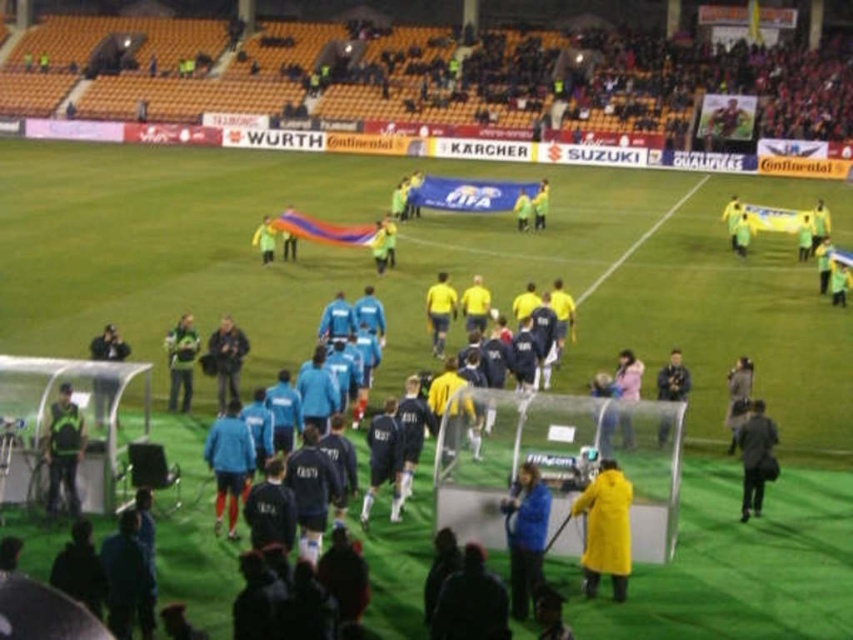
Question: Among these points, which one is farthest from the camera?

Choices:
 (A) (105, 340)
 (B) (223, 502)
 (C) (756, 474)

Answer: (A)

Question: Considering the real-world distances, which object is farthest from the yellow matte shirt at center?

Choices:
 (A) blue fabric jacket at center
 (B) black matte jacket at lower right
 (C) yellow matte raincoat at lower right
 (D) dark blue jacket at center

Answer: (C)

Question: Is green jersey at center closer to the viewer compared to light blue jersey at center?

Choices:
 (A) yes
 (B) no

Answer: (A)

Question: Can you confirm if blue matte jacket at center is positioned to the right of light blue jersey at center?

Choices:
 (A) no
 (B) yes

Answer: (B)

Question: Which object appears farthest from the camera in this image?

Choices:
 (A) light blue jersey at center
 (B) black leather jacket at center
 (C) yellow matte raincoat at lower right

Answer: (A)

Question: Can you confirm if black leather jacket at center is thinner than dark blue jacket at center?

Choices:
 (A) yes
 (B) no

Answer: (B)